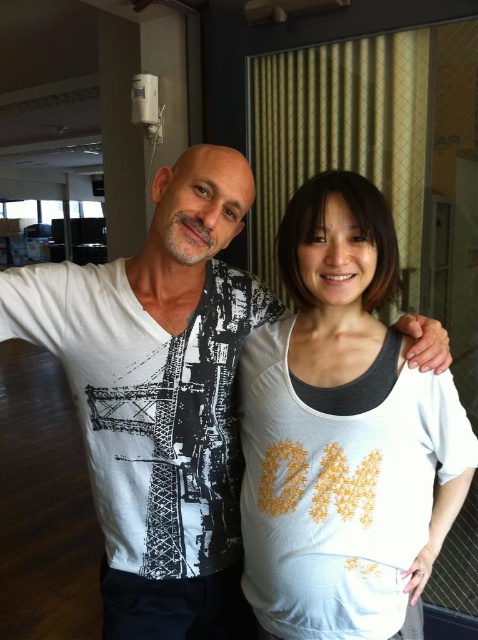
Question: In this image, where is white cotton tank top at center located relative to white printed shirt at center?

Choices:
 (A) left
 (B) right

Answer: (B)

Question: Does white cotton tank top at center have a greater width compared to white printed shirt at center?

Choices:
 (A) yes
 (B) no

Answer: (B)

Question: Which object appears farthest from the camera in this image?

Choices:
 (A) white printed shirt at center
 (B) white cotton tank top at center

Answer: (A)

Question: Among these points, which one is nearest to the camera?

Choices:
 (A) (140, 371)
 (B) (327, 632)

Answer: (B)

Question: Where is white cotton tank top at center located in relation to white printed shirt at center in the image?

Choices:
 (A) below
 (B) above

Answer: (A)